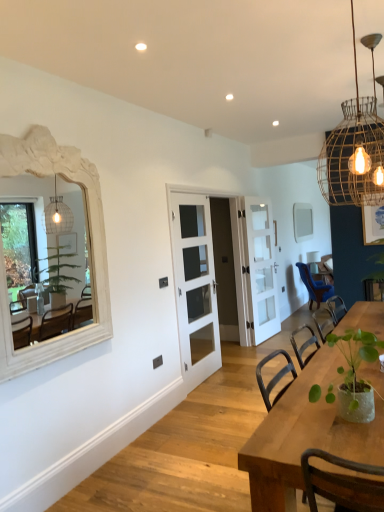
Where is `free space to the left of green matte plant at lower right`? Image resolution: width=384 pixels, height=512 pixels. free space to the left of green matte plant at lower right is located at coordinates pyautogui.click(x=291, y=423).